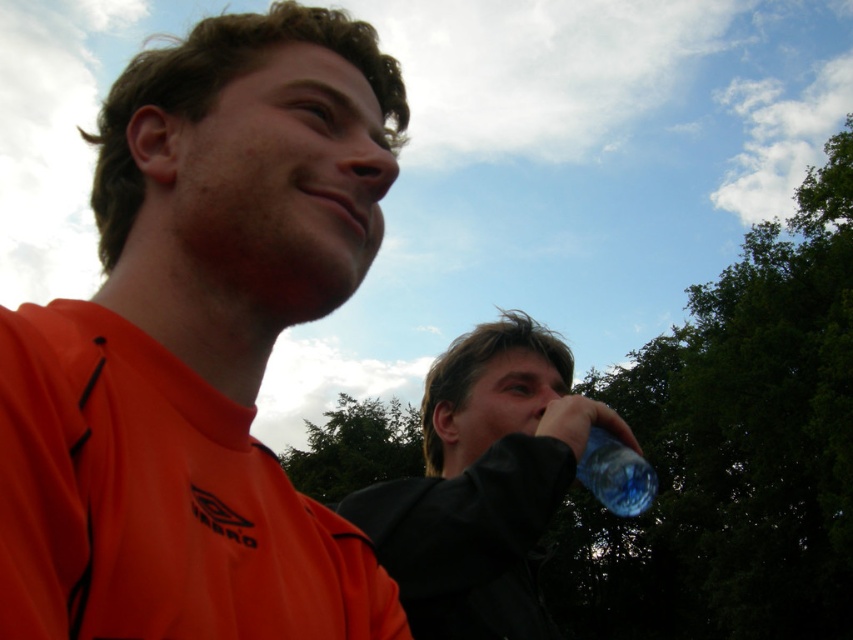
Question: Considering the real-world distances, which object is farthest from the orange matte shirt at upper left?

Choices:
 (A) transparent plastic bottle at right
 (B) transparent plastic bottle at center

Answer: (A)

Question: Is transparent plastic bottle at center above transparent plastic bottle at right?

Choices:
 (A) yes
 (B) no

Answer: (B)

Question: From the image, what is the correct spatial relationship of orange matte shirt at upper left in relation to transparent plastic bottle at right?

Choices:
 (A) above
 (B) below

Answer: (A)

Question: Which is nearer to the orange matte shirt at upper left?

Choices:
 (A) transparent plastic bottle at center
 (B) transparent plastic bottle at right

Answer: (A)

Question: Can you confirm if orange matte shirt at upper left is wider than transparent plastic bottle at center?

Choices:
 (A) no
 (B) yes

Answer: (A)

Question: Among these points, which one is farthest from the camera?

Choices:
 (A) (41, 474)
 (B) (625, 492)
 (C) (434, 419)

Answer: (C)